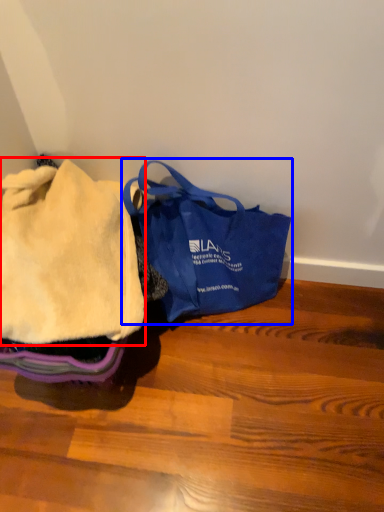
Question: Which point is closer to the camera, cloth (highlighted by a red box) or handbag (highlighted by a blue box)?

Choices:
 (A) cloth
 (B) handbag

Answer: (A)